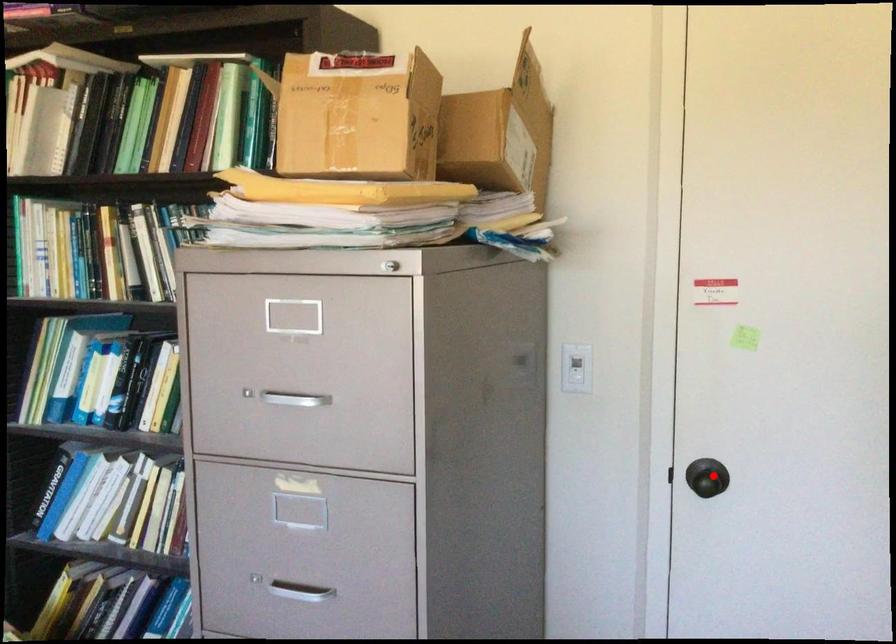
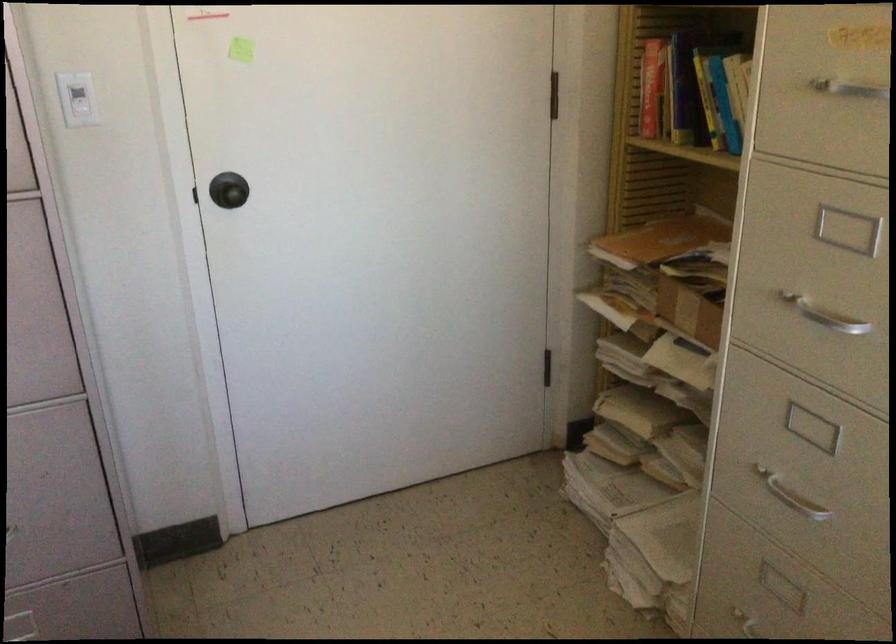
Find the pixel in the second image that matches the highlighted location in the first image.

(228, 190)